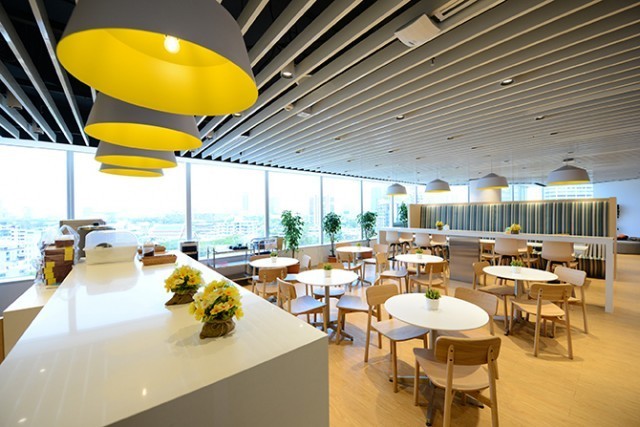
Locate an element on the screen. The image size is (640, 427). round tables is located at coordinates (529, 276), (411, 257), (349, 247), (271, 262), (333, 279), (422, 318).